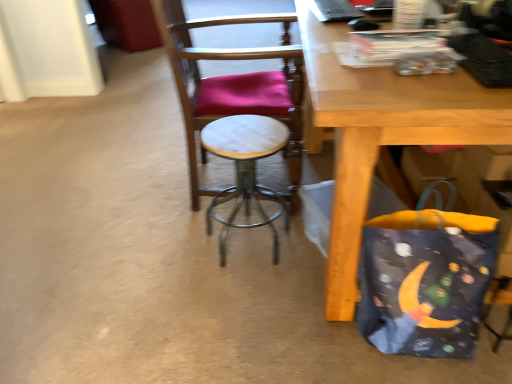
Image resolution: width=512 pixels, height=384 pixels. Identify the location of free space between marble seat at center and white marble stool at center. [x=208, y=238].